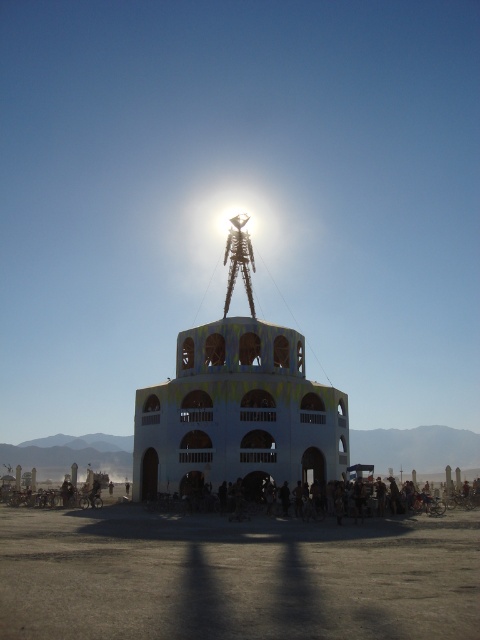
Question: Where is dirt field at center located in relation to white painted wood tower at center in the image?

Choices:
 (A) right
 (B) left

Answer: (A)

Question: Where is dirt field at center located in relation to white painted wood tower at center in the image?

Choices:
 (A) above
 (B) below

Answer: (B)

Question: Does dirt field at center appear over white painted wood tower at center?

Choices:
 (A) yes
 (B) no

Answer: (B)